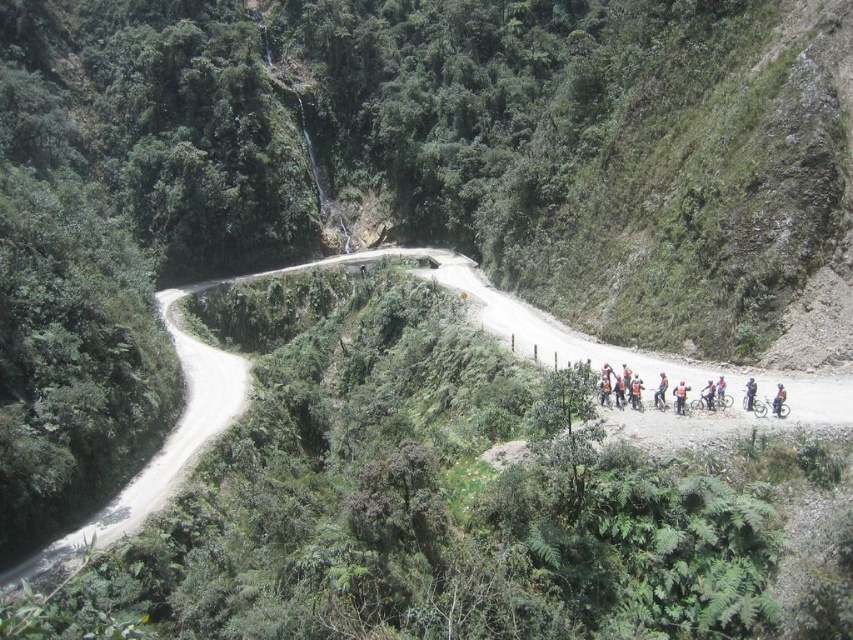
The height and width of the screenshot is (640, 853). What do you see at coordinates (680, 397) in the screenshot?
I see `orange fabric cyclist at center` at bounding box center [680, 397].

Between orange fabric cyclist at center and blue fabric helmet at center, which one has less height?

Standing shorter between the two is blue fabric helmet at center.

Where is `orange fabric cyclist at center`? The width and height of the screenshot is (853, 640). orange fabric cyclist at center is located at coordinates (680, 397).